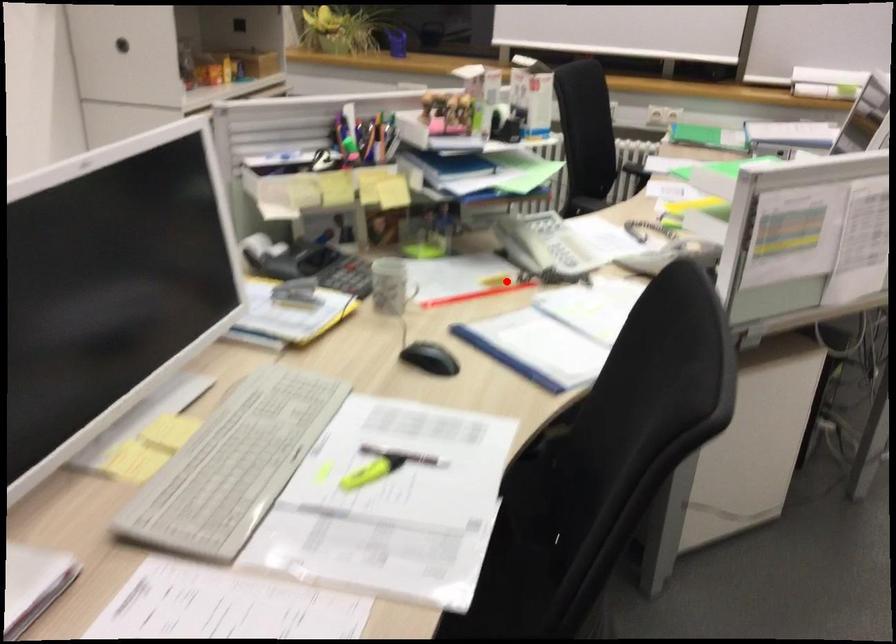
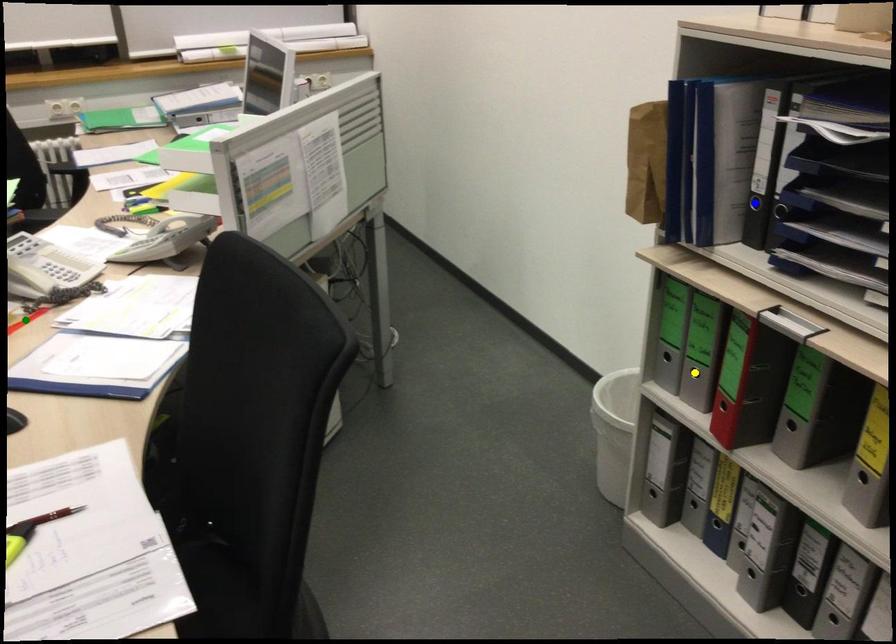
Question: I am providing you with two images of the same scene from different viewpoints. A red point is marked on the first image. You are given multiple points on the second image. Which point in image 2 is actually the same real-world point as the red point in image 1?

Choices:
 (A) blue point
 (B) yellow point
 (C) green point

Answer: (C)